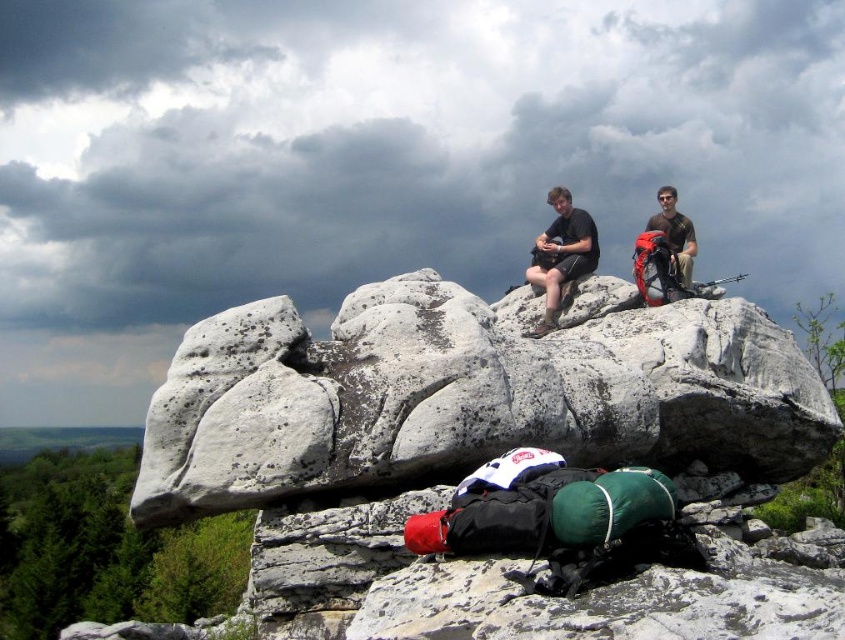
You are planning to pack your camping gear. You have a matte black backpacks at center and a brown cotton shirt at upper right. Which item can you fit into the other?

The brown cotton shirt at upper right can fit into the matte black backpacks at center since the backpack is larger in size than the shirt.

You are planning to pack your camping gear. You have a matte black backpacks at center and a brown cotton shirt at upper right. Which item has a larger width?

The matte black backpacks at center has a larger width than the brown cotton shirt at upper right.

You are a hiker who needs to retrieve your shorts that are at the center of the scene. The white rough rock at center is blocking your path. Can you walk around it to reach the matte black shorts at center?

The white rough rock at center and matte black shorts at center are 10.54 meters apart. Since the rock is blocking the direct path, you can walk around it to reach the shorts as the distance allows for maneuvering around the obstacle.